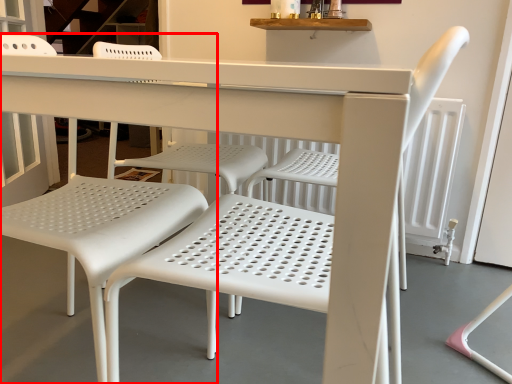
Question: From the image, what is the correct spatial relationship of chair (annotated by the red box) in relation to chair?

Choices:
 (A) left
 (B) right

Answer: (A)